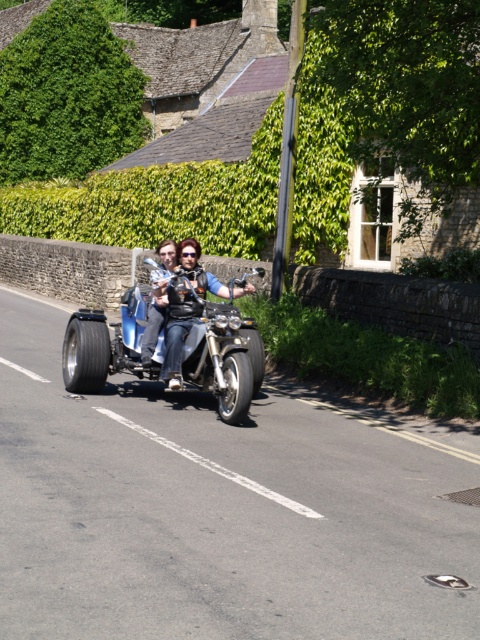
You are a cyclist approaching the shiny chrome motorcycle at center. There is a green leafy hedge at upper left blocking your path. Can you safely navigate around it without hitting the hedge?

The green leafy hedge at upper left is to the left of the shiny chrome motorcycle at center, so you can safely navigate around it by moving to the right side of the motorcycle to avoid the hedge.